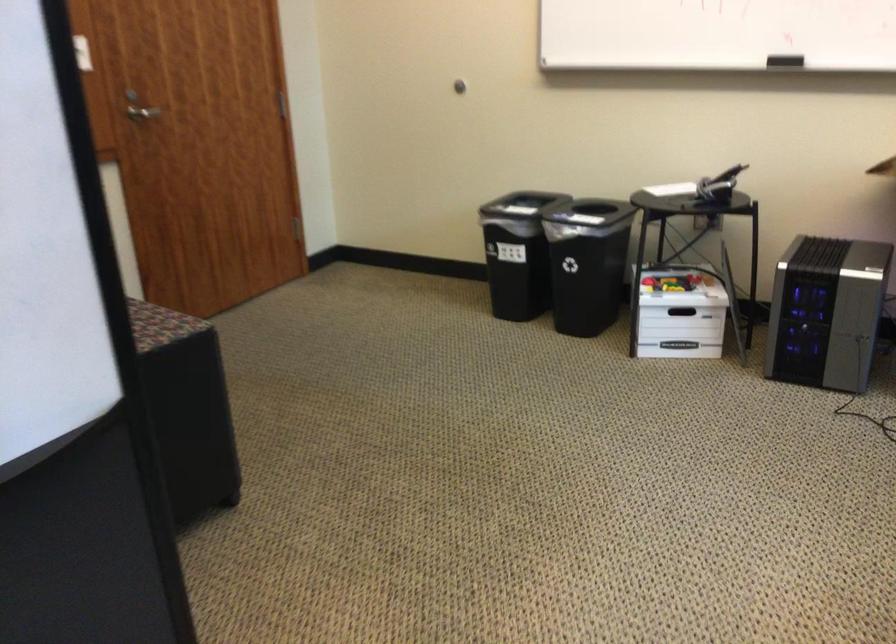
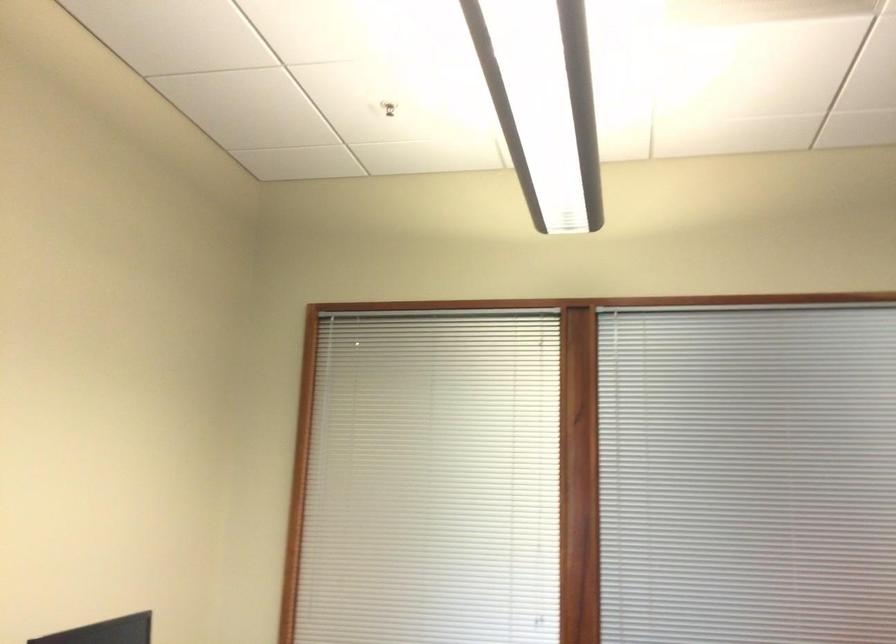
First-person continuous shooting, in which direction is the camera rotating?

The camera's rotation is toward left-up.